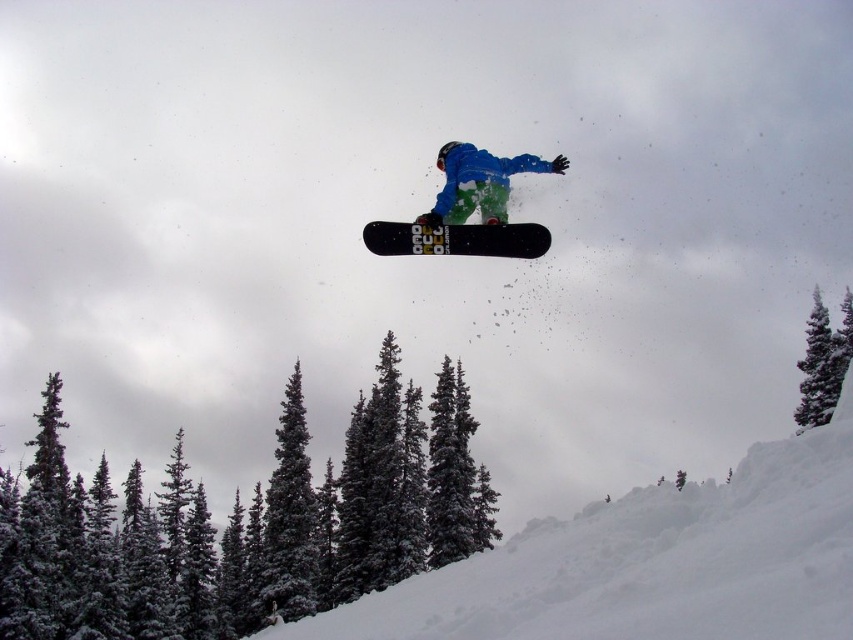
Question: Which of the following is the closest to the observer?

Choices:
 (A) (233, 612)
 (B) (799, 365)
 (C) (489, 221)

Answer: (C)

Question: Is snowy evergreen trees at lower left positioned before green textured pine tree at center?

Choices:
 (A) yes
 (B) no

Answer: (A)

Question: Which point is closer to the camera taking this photo?

Choices:
 (A) (471, 240)
 (B) (258, 508)
 (C) (819, 422)
 (D) (532, 244)

Answer: (D)

Question: Does snowy evergreen trees at lower left appear under green textured pine tree at center?

Choices:
 (A) yes
 (B) no

Answer: (A)

Question: Can you confirm if black matte snowboard at center is positioned to the right of green textured pine tree at center?

Choices:
 (A) yes
 (B) no

Answer: (B)

Question: Estimate the real-world distances between objects in this image. Which object is closer to the green textured pine tree at center?

Choices:
 (A) black matte snowboard at center
 (B) matte black snowboard at center
 (C) snowy evergreen trees at lower left

Answer: (C)